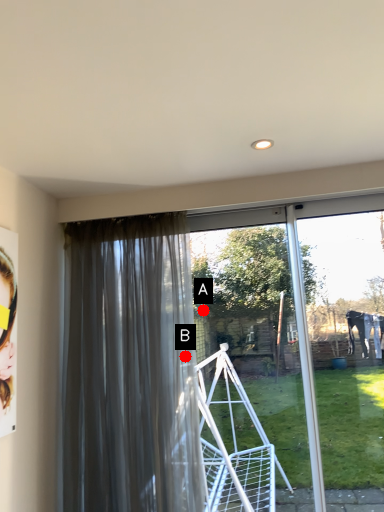
Question: Two points are circled on the image, labeled by A and B beside each circle. Which point is closer to the camera?

Choices:
 (A) A is closer
 (B) B is closer

Answer: (B)